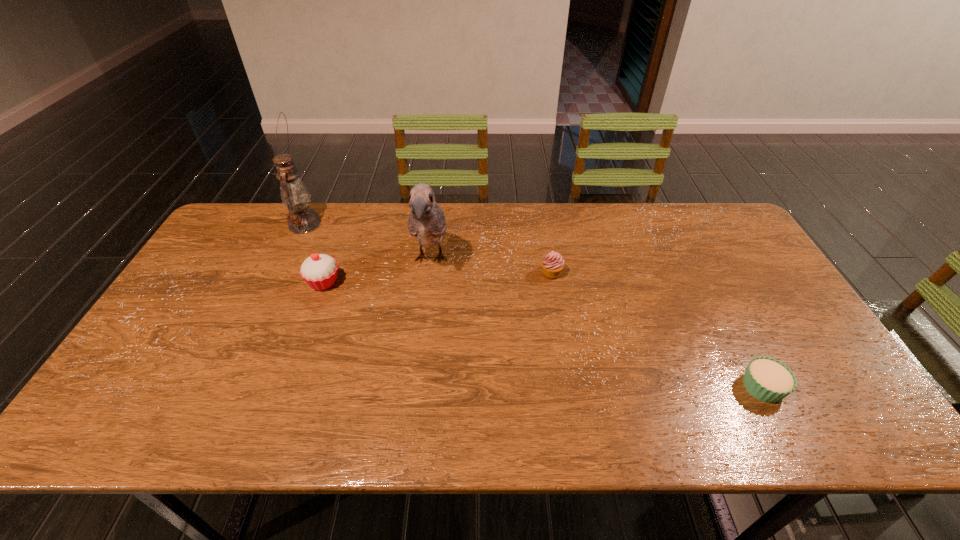
Locate an element on the screen. Image resolution: width=960 pixels, height=540 pixels. free space that satisfies the following two spatial constraints: 1. on the front-facing side of the third object from left to right; 2. on the right side of the shortest object is located at coordinates (416, 387).

Identify the location of free space in the image that satisfies the following two spatial constraints: 1. on the front-facing side of the fourth shortest object; 2. on the right side of the shortest object. This screenshot has width=960, height=540. (416, 387).